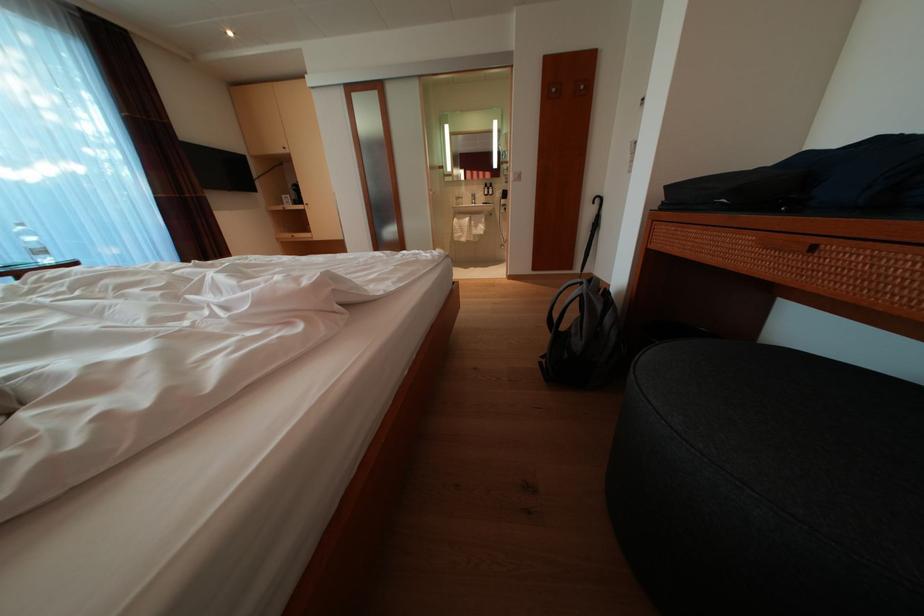
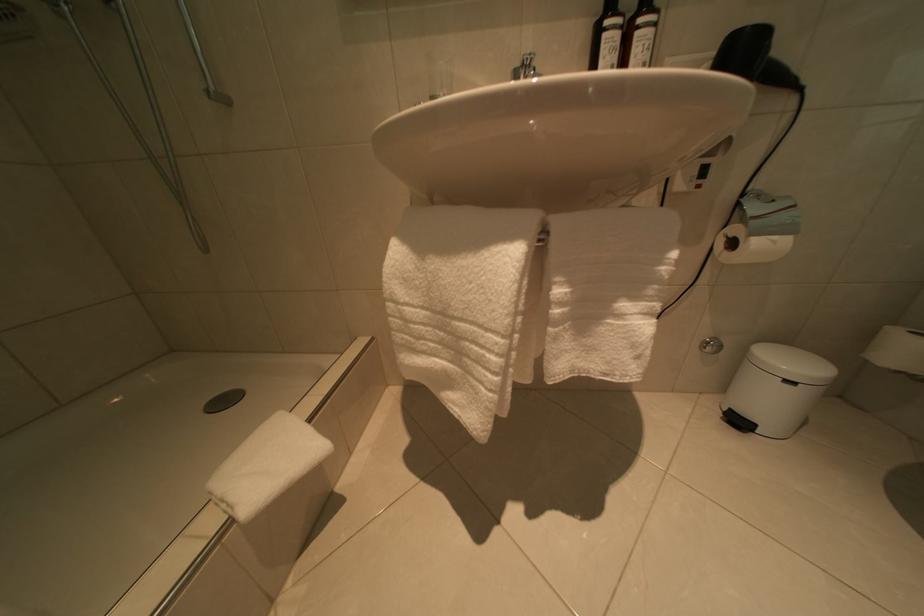
Where in the second image is the point corresponding to the point at 476,225 from the first image?

(517, 262)